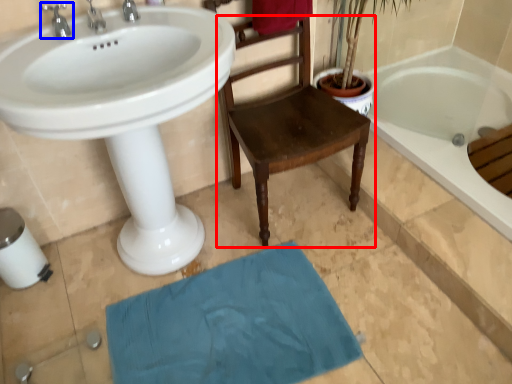
Question: Which of the following is the closest to the observer, chair (highlighted by a red box) or tap (highlighted by a blue box)?

Choices:
 (A) chair
 (B) tap

Answer: (A)